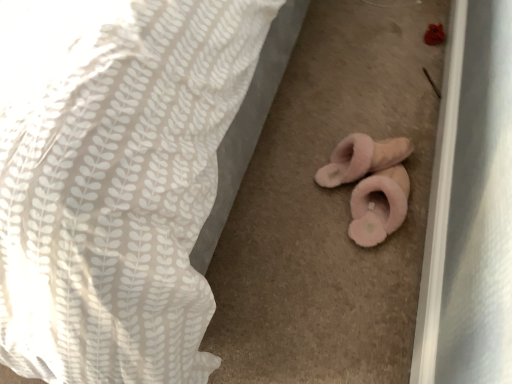
The height and width of the screenshot is (384, 512). Identify the location of pink fluffy slippers at lower center. (371, 184).

What do you see at coordinates (371, 184) in the screenshot? I see `pink fluffy slippers at lower center` at bounding box center [371, 184].

At what (x,y) coordinates should I click in order to perform the action: click on white textured fabric at center. Please return your answer as a coordinate pair (x, y). Looking at the image, I should click on (114, 180).

Image resolution: width=512 pixels, height=384 pixels. What do you see at coordinates (114, 180) in the screenshot? I see `white textured fabric at center` at bounding box center [114, 180].

Find the location of a particular element. The image size is (512, 384). pink fluffy slippers at lower center is located at coordinates (371, 184).

Is pink fluffy slippers at lower center to the left of white textured fabric at center from the viewer's perspective?

No, pink fluffy slippers at lower center is not to the left of white textured fabric at center.

Is pink fluffy slippers at lower center positioned behind white textured fabric at center?

Yes, pink fluffy slippers at lower center is further from the viewer.

Does point (353, 214) lie in front of point (64, 344)?

No, (353, 214) is further to viewer.

From the image's perspective, is pink fluffy slippers at lower center beneath white textured fabric at center?

Indeed, from the image's perspective, pink fluffy slippers at lower center is shown beneath white textured fabric at center.

From a real-world perspective, who is located lower, pink fluffy slippers at lower center or white textured fabric at center?

In real-world perspective, pink fluffy slippers at lower center is lower.

In terms of width, does pink fluffy slippers at lower center look wider or thinner when compared to white textured fabric at center?

Clearly, pink fluffy slippers at lower center has less width compared to white textured fabric at center.

Is pink fluffy slippers at lower center taller or shorter than white textured fabric at center?

pink fluffy slippers at lower center is shorter than white textured fabric at center.

Does pink fluffy slippers at lower center have a smaller size compared to white textured fabric at center?

Indeed, pink fluffy slippers at lower center has a smaller size compared to white textured fabric at center.

In the scene shown: Is white textured fabric at center inside pink fluffy slippers at lower center?

That's incorrect, white textured fabric at center is not inside pink fluffy slippers at lower center.

Is pink fluffy slippers at lower center far from white textured fabric at center?

pink fluffy slippers at lower center is near white textured fabric at center, not far away.

Could you tell me if pink fluffy slippers at lower center is turned towards white textured fabric at center?

No, pink fluffy slippers at lower center is not aimed at white textured fabric at center.

How many degrees apart are the facing directions of pink fluffy slippers at lower center and white textured fabric at center?

The facing directions of pink fluffy slippers at lower center and white textured fabric at center are 168 degrees apart.

Identify the location of bed above the pink fluffy slippers at lower center (from a real-world perspective). (114, 180).

Which is more to the left, white textured fabric at center or pink fluffy slippers at lower center?

From the viewer's perspective, white textured fabric at center appears more on the left side.

Does white textured fabric at center come in front of pink fluffy slippers at lower center?

Yes, white textured fabric at center is in front of pink fluffy slippers at lower center.

Considering the points (192, 92) and (400, 220), which point is behind, point (192, 92) or point (400, 220)?

The point (400, 220) is farther from the camera.

From the image's perspective, does white textured fabric at center appear lower than pink fluffy slippers at lower center?

No.

From a real-world perspective, relative to pink fluffy slippers at lower center, is white textured fabric at center vertically above or below?

From a real-world perspective, white textured fabric at center is physically above pink fluffy slippers at lower center.

Considering the sizes of objects white textured fabric at center and pink fluffy slippers at lower center in the image provided, who is wider, white textured fabric at center or pink fluffy slippers at lower center?

white textured fabric at center.

In terms of height, does white textured fabric at center look taller or shorter compared to pink fluffy slippers at lower center?

Clearly, white textured fabric at center is taller compared to pink fluffy slippers at lower center.

Does white textured fabric at center have a larger size compared to pink fluffy slippers at lower center?

Yes.

Is pink fluffy slippers at lower center a part of white textured fabric at center?

No, pink fluffy slippers at lower center is not surrounded by white textured fabric at center.

From the picture: Is the surface of white textured fabric at center in direct contact with pink fluffy slippers at lower center?

No, white textured fabric at center is not beside pink fluffy slippers at lower center.

Is white textured fabric at center turned away from pink fluffy slippers at lower center?

No.

How different are the orientations of white textured fabric at center and pink fluffy slippers at lower center in degrees?

The angle between the facing direction of white textured fabric at center and the facing direction of pink fluffy slippers at lower center is 168 degrees.

How far apart are white textured fabric at center and pink fluffy slippers at lower center?

The distance of white textured fabric at center from pink fluffy slippers at lower center is 24.35 inches.

Image resolution: width=512 pixels, height=384 pixels. What are the coordinates of `stuff that is under the white textured fabric at center (from a real-world perspective)` in the screenshot? It's located at (371, 184).

Where is `bed above the pink fluffy slippers at lower center (from the image's perspective)`? Image resolution: width=512 pixels, height=384 pixels. bed above the pink fluffy slippers at lower center (from the image's perspective) is located at coordinates (114, 180).

Locate an element on the screen. bed on the left of pink fluffy slippers at lower center is located at coordinates (114, 180).